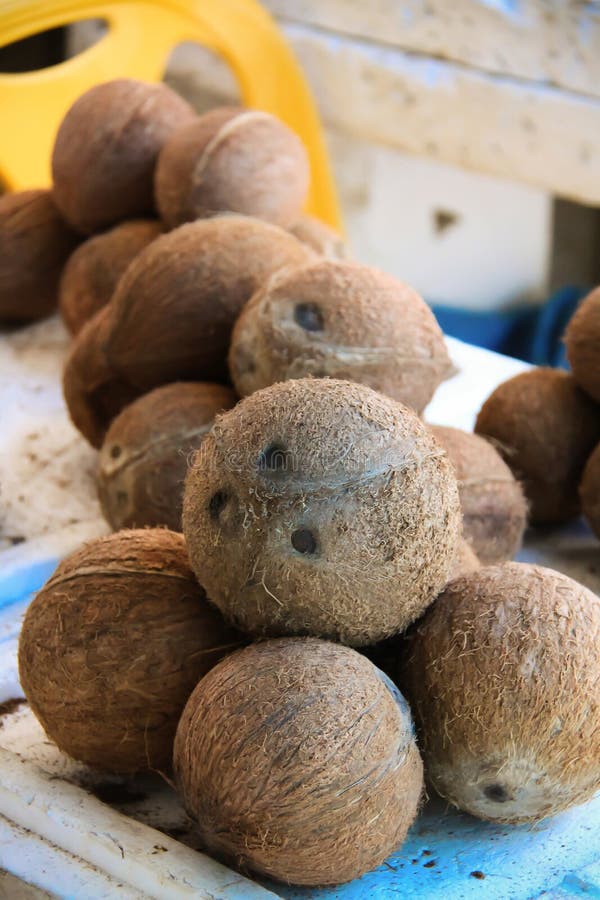
I want to click on off-white painted slats, so click(505, 37), click(497, 124).